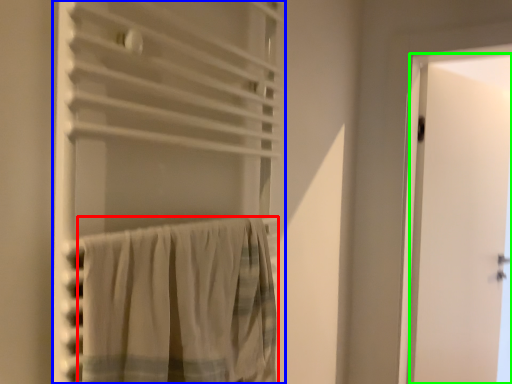
Question: Which is nearer to the curtain (highlighted by a red box)? curtain (highlighted by a blue box) or door (highlighted by a green box).

Choices:
 (A) curtain
 (B) door

Answer: (A)